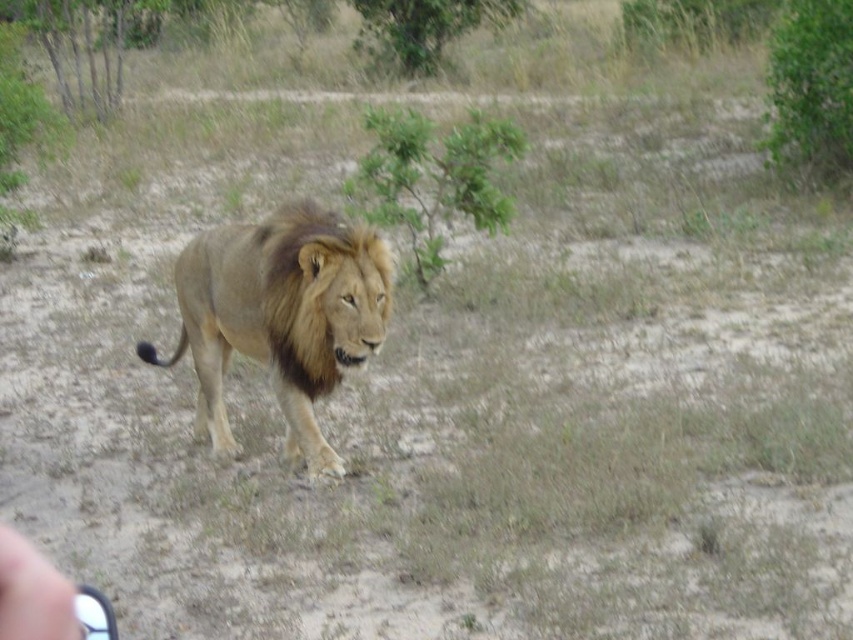
Can you confirm if golden brown fur lion at center is positioned above brown fuzzy mane at center?

Actually, golden brown fur lion at center is below brown fuzzy mane at center.

Is point (276, 284) more distant than point (316, 273)?

Yes, point (276, 284) is farther from viewer.

Image resolution: width=853 pixels, height=640 pixels. What are the coordinates of `golden brown fur lion at center` in the screenshot? It's located at (280, 316).